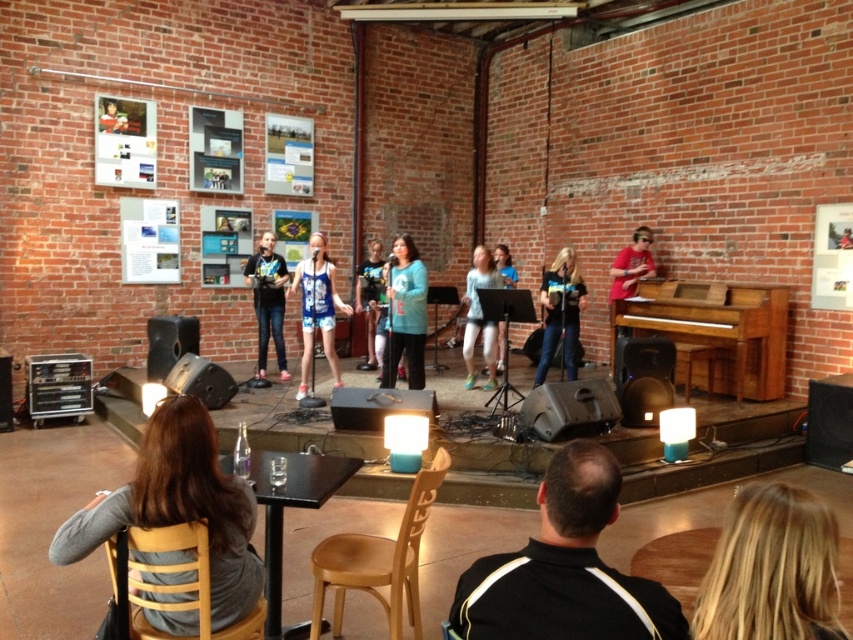
Question: Among these objects, which one is nearest to the camera?

Choices:
 (A) matte blue shirt at center
 (B) gray fabric shirt at lower left
 (C) matte black speaker at center
 (D) matte black jacket at center

Answer: (B)

Question: Can you confirm if black matte speaker at lower left is wider than matte black speaker at lower left?

Choices:
 (A) yes
 (B) no

Answer: (B)

Question: Estimate the real-world distances between objects in this image. Which object is farther from the matte blue jeans at center?

Choices:
 (A) black matte speaker at lower left
 (B) black matte speaker at lower right

Answer: (A)

Question: Observing the image, what is the correct spatial positioning of matte blue jeans at center in reference to black matte speaker at center?

Choices:
 (A) below
 (B) above

Answer: (B)

Question: Which object is the closest to the black matte speaker at lower left?

Choices:
 (A) blonde hair at lower right
 (B) matte blue shirt at center
 (C) black leather jacket at lower right
 (D) black matte speaker at center

Answer: (B)

Question: Can you confirm if matte blue jeans at center is positioned to the left of wooden stool at center?

Choices:
 (A) no
 (B) yes

Answer: (B)